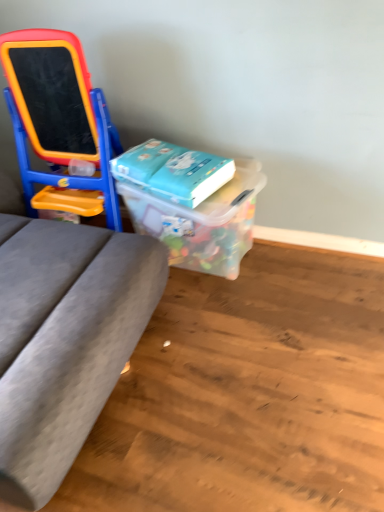
Question: Is matte plastic easel at left at the back of blue matte book at center?

Choices:
 (A) no
 (B) yes

Answer: (A)

Question: Can matte plastic easel at left be found inside blue matte book at center?

Choices:
 (A) yes
 (B) no

Answer: (B)

Question: Does blue matte book at center have a smaller size compared to matte plastic easel at left?

Choices:
 (A) yes
 (B) no

Answer: (A)

Question: From the image's perspective, is blue matte book at center beneath matte plastic easel at left?

Choices:
 (A) yes
 (B) no

Answer: (A)

Question: Is blue matte book at center closer to the viewer compared to matte plastic easel at left?

Choices:
 (A) no
 (B) yes

Answer: (A)

Question: Is translucent plastic container at center spatially inside blue matte book at center, or outside of it?

Choices:
 (A) inside
 (B) outside

Answer: (B)

Question: Is translucent plastic container at center to the left or to the right of blue matte book at center in the image?

Choices:
 (A) left
 (B) right

Answer: (B)

Question: Considering the positions of translucent plastic container at center and blue matte book at center in the image, is translucent plastic container at center taller or shorter than blue matte book at center?

Choices:
 (A) short
 (B) tall

Answer: (B)

Question: Is translucent plastic container at center wider or thinner than blue matte book at center?

Choices:
 (A) wide
 (B) thin

Answer: (A)

Question: From their relative heights in the image, would you say matte plastic easel at left is taller or shorter than blue matte book at center?

Choices:
 (A) short
 (B) tall

Answer: (B)

Question: Considering the positions of matte plastic easel at left and blue matte book at center in the image, is matte plastic easel at left wider or thinner than blue matte book at center?

Choices:
 (A) wide
 (B) thin

Answer: (A)

Question: Which is correct: matte plastic easel at left is inside blue matte book at center, or outside of it?

Choices:
 (A) inside
 (B) outside

Answer: (B)

Question: From the image's perspective, is matte plastic easel at left above or below blue matte book at center?

Choices:
 (A) above
 (B) below

Answer: (A)

Question: Does point (77, 161) appear closer or farther from the camera than point (196, 215)?

Choices:
 (A) farther
 (B) closer

Answer: (A)

Question: From their relative heights in the image, would you say matte plastic easel at left is taller or shorter than translucent plastic container at center?

Choices:
 (A) short
 (B) tall

Answer: (B)